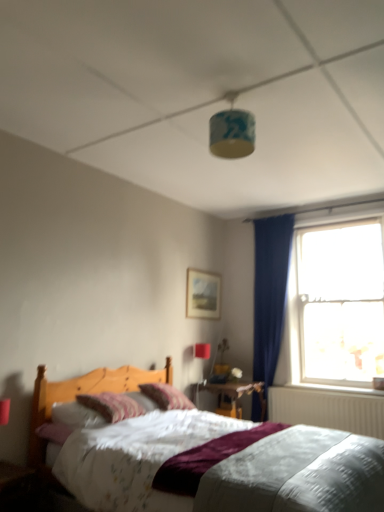
Question: From the image's perspective, is wooden nightstand at center positioned above or below transparent glass window at right?

Choices:
 (A) above
 (B) below

Answer: (B)

Question: Is wooden nightstand at center inside the boundaries of transparent glass window at right, or outside?

Choices:
 (A) outside
 (B) inside

Answer: (A)

Question: Which of these objects is positioned closest to the wooden nightstand at center?

Choices:
 (A) blue fabric lampshade at upper center, arranged as the first light fixture when viewed from the front
 (B) transparent glass window at right
 (C) striped fabric pillow at center, which is the 1th pillow from front to back
 (D) white glossy window sill at lower right
 (E) matte white lampshade at upper center, the 1th light fixture from the bottom

Answer: (E)

Question: Based on their relative distances, which object is nearer to the white glossy window sill at lower right?

Choices:
 (A) velvet purple pillow at center, which is counted as the 1th pillow, starting from the back
 (B) striped fabric pillow at center, the second pillow when ordered from back to front
 (C) blue fabric lampshade at upper center, acting as the 1th light fixture starting from the top
 (D) transparent glass window at right
 (E) wooden picture frame at upper center

Answer: (D)